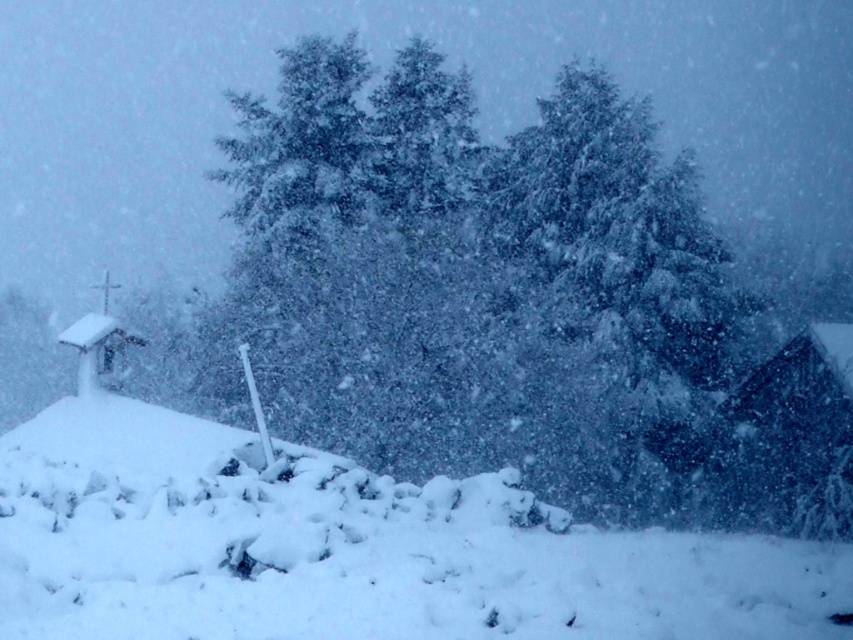
You are standing in the winter scene and want to walk from the wooden cabin at right to the white fluffy snow at lower center. Which direction should you move?

You should move to the left towards the white fluffy snow at lower center since it is located to the left of the wooden cabin at right.

You are standing in the winter scene described. You want to place a small red ornament exactly at the point marked by coordinates point [350,548]. What will the ornament be placed on?

Answer: The ornament will be placed on the white fluffy snow at lower center indicated by point [350,548].

You are standing in the winter scene described. If you want to place a small red ornament exactly at the coordinates provided in the description, where would you place it relative to the white fluffy snow at lower center?

The coordinates given for the white fluffy snow at lower center are at point [350,548]. Therefore, you should place the small red ornament exactly at that point relative to the white fluffy snow at lower center.